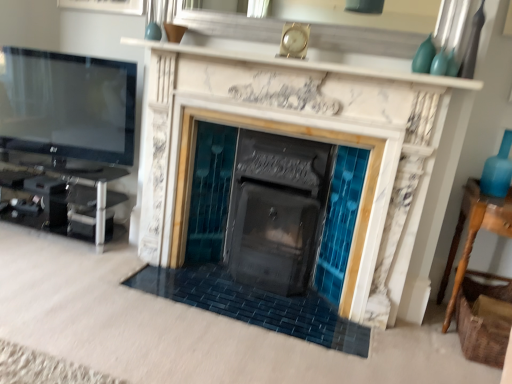
The width and height of the screenshot is (512, 384). What do you see at coordinates (67, 105) in the screenshot?
I see `flat screen tv at left` at bounding box center [67, 105].

Locate an element on the screen. The height and width of the screenshot is (384, 512). matte glass vase at upper right, which is the 1th turquoise in back-to-front order is located at coordinates (424, 56).

Find the location of a particular element. This screenshot has width=512, height=384. flat screen tv at left is located at coordinates (67, 105).

Would you say turquoise glass vase at upper right, which is the first turquoise from front to back, is inside or outside matte glass vase at upper right, which is the 1th turquoise in back-to-front order?

turquoise glass vase at upper right, which is the first turquoise from front to back, cannot be found inside matte glass vase at upper right, which is the 1th turquoise in back-to-front order.

Is turquoise glass vase at upper right, which is the first turquoise from front to back, in contact with matte glass vase at upper right, which is the 1th turquoise in back-to-front order?

Yes, turquoise glass vase at upper right, which is the first turquoise from front to back, is beside matte glass vase at upper right, which is the 1th turquoise in back-to-front order.

Considering the relative sizes of turquoise glass vase at upper right, which is the second turquoise in back-to-front order, and matte glass vase at upper right, which is the 1th turquoise in back-to-front order, in the image provided, is turquoise glass vase at upper right, which is the second turquoise in back-to-front order, thinner than matte glass vase at upper right, which is the 1th turquoise in back-to-front order,?

Indeed, turquoise glass vase at upper right, which is the second turquoise in back-to-front order, has a lesser width compared to matte glass vase at upper right, which is the 1th turquoise in back-to-front order.

Is turquoise glass vase at upper right, which is the second turquoise in back-to-front order, bigger or smaller than matte glass vase at upper right, positioned as the 2th turquoise in front-to-back order?

Considering their sizes, turquoise glass vase at upper right, which is the second turquoise in back-to-front order, takes up less space than matte glass vase at upper right, positioned as the 2th turquoise in front-to-back order.

Can you confirm if marble fireplace at center is wider than white marble mantle at upper center?

Yes, marble fireplace at center is wider than white marble mantle at upper center.

Looking at this image, is marble fireplace at center next to white marble mantle at upper center?

marble fireplace at center and white marble mantle at upper center are clearly separated.

From the image's perspective, between marble fireplace at center and white marble mantle at upper center, who is located below?

marble fireplace at center appears lower in the image.

Does marble fireplace at center have a lesser height compared to white marble mantle at upper center?

No, marble fireplace at center is not shorter than white marble mantle at upper center.

Is marble fireplace at center taller than matte glass vase at upper right, which is the 1th turquoise in back-to-front order?

Indeed, marble fireplace at center has a greater height compared to matte glass vase at upper right, which is the 1th turquoise in back-to-front order.

In the scene shown: Is marble fireplace at center not inside matte glass vase at upper right, positioned as the 2th turquoise in front-to-back order?

Yes, marble fireplace at center is not within matte glass vase at upper right, positioned as the 2th turquoise in front-to-back order.

Measure the distance from marble fireplace at center to matte glass vase at upper right, which is the 1th turquoise in back-to-front order.

marble fireplace at center is 37.07 inches away from matte glass vase at upper right, which is the 1th turquoise in back-to-front order.

Considering the relative sizes of marble fireplace at center and matte glass vase at upper right, which is the 1th turquoise in back-to-front order, in the image provided, is marble fireplace at center smaller than matte glass vase at upper right, which is the 1th turquoise in back-to-front order,?

Incorrect, marble fireplace at center is not smaller in size than matte glass vase at upper right, which is the 1th turquoise in back-to-front order.

Considering the positions of objects marble fireplace at center and turquoise glass vase at upper right, which is the second turquoise in back-to-front order, in the image provided, who is in front, marble fireplace at center or turquoise glass vase at upper right, which is the second turquoise in back-to-front order,?

marble fireplace at center.

From a real-world perspective, does marble fireplace at center sit lower than turquoise glass vase at upper right, which is the second turquoise in back-to-front order?

Yes, from a real-world perspective, marble fireplace at center is below turquoise glass vase at upper right, which is the second turquoise in back-to-front order.

Can you confirm if marble fireplace at center is wider than turquoise glass vase at upper right, which is the first turquoise from front to back?

Yes.

Considering the relative sizes of marble fireplace at center and turquoise glass vase at upper right, which is the first turquoise from front to back, in the image provided, is marble fireplace at center shorter than turquoise glass vase at upper right, which is the first turquoise from front to back,?

In fact, marble fireplace at center may be taller than turquoise glass vase at upper right, which is the first turquoise from front to back.

Which object is positioned more to the left, turquoise glass vase at upper right, which is the second turquoise in back-to-front order, or white marble mantle at upper center?

white marble mantle at upper center is more to the left.

Is turquoise glass vase at upper right, which is the first turquoise from front to back, situated inside white marble mantle at upper center or outside?

turquoise glass vase at upper right, which is the first turquoise from front to back, is not enclosed by white marble mantle at upper center.

Which is nearer, (434, 63) or (445, 77)?

Point (434, 63) appears to be farther away from the viewer than point (445, 77).

Is flat screen tv at left outside of matte glass vase at upper right, which is the 1th turquoise in back-to-front order?

Yes, flat screen tv at left is located beyond the bounds of matte glass vase at upper right, which is the 1th turquoise in back-to-front order.

Can you confirm if flat screen tv at left is thinner than matte glass vase at upper right, which is the 1th turquoise in back-to-front order?

No, flat screen tv at left is not thinner than matte glass vase at upper right, which is the 1th turquoise in back-to-front order.

Which object is positioned more to the left, flat screen tv at left or matte glass vase at upper right, which is the 1th turquoise in back-to-front order?

flat screen tv at left.

Find the location of a particular element. Image resolution: width=512 pixels, height=384 pixels. the 2nd turquoise positioned above the flat screen tv at left (from the image's perspective) is located at coordinates (424, 56).

In the scene shown: Is white marble mantle at upper center facing towards marble fireplace at center?

No, white marble mantle at upper center is not oriented towards marble fireplace at center.

In the image, is white marble mantle at upper center positioned in front of or behind marble fireplace at center?

Visually, white marble mantle at upper center is located behind marble fireplace at center.

Can you confirm if white marble mantle at upper center is thinner than marble fireplace at center?

Indeed, white marble mantle at upper center has a lesser width compared to marble fireplace at center.

Image resolution: width=512 pixels, height=384 pixels. I want to click on mantle lying behind the marble fireplace at center, so click(x=308, y=64).

Image resolution: width=512 pixels, height=384 pixels. In order to click on turquoise above the turquoise glass vase at upper right, which is the second turquoise in back-to-front order (from a real-world perspective) in this screenshot , I will do `click(424, 56)`.

Locate an element on the screen. Image resolution: width=512 pixels, height=384 pixels. fireplace on the left side of white marble mantle at upper center is located at coordinates (300, 169).

Based on their spatial positions, is white marble mantle at upper center or marble fireplace at center closer to blue glass vase at right?

Based on the image, white marble mantle at upper center appears to be nearer to blue glass vase at right.

Estimate the real-world distances between objects in this image. Which object is further from marble fireplace at center, white marble mantle at upper center or matte glass vase at upper right, which is the 1th turquoise in back-to-front order?

Among the two, matte glass vase at upper right, which is the 1th turquoise in back-to-front order, is located further to marble fireplace at center.

Based on their spatial positions, is wooden table at right or matte glass vase at upper right, which is the 1th turquoise in back-to-front order, further from flat screen tv at left?

Among the two, wooden table at right is located further to flat screen tv at left.

Considering their positions, is blue glass vase at right positioned further to marble fireplace at center than matte glass vase at upper right, positioned as the 2th turquoise in front-to-back order?

blue glass vase at right lies further to marble fireplace at center than the other object.

Based on the photo, from the image, which object appears to be farther from white marble mantle at upper center, matte glass vase at upper right, which is the 1th turquoise in back-to-front order, or turquoise glass vase at upper right, which is the second turquoise in back-to-front order?

Among the two, turquoise glass vase at upper right, which is the second turquoise in back-to-front order, is located further to white marble mantle at upper center.

When comparing their distances from matte glass vase at upper right, positioned as the 2th turquoise in front-to-back order, does turquoise glass vase at upper right, which is the second turquoise in back-to-front order, or marble fireplace at center seem further?

marble fireplace at center lies further to matte glass vase at upper right, positioned as the 2th turquoise in front-to-back order, than the other object.

Based on their spatial positions, is marble fireplace at center or blue glass vase at right further from matte glass vase at upper right, positioned as the 2th turquoise in front-to-back order?

marble fireplace at center is positioned further to the anchor matte glass vase at upper right, positioned as the 2th turquoise in front-to-back order.

Based on their spatial positions, is marble fireplace at center or blue glass vase at right closer to white marble mantle at upper center?

Among the two, marble fireplace at center is located nearer to white marble mantle at upper center.

Find the location of a particular element. This screenshot has width=512, height=384. mantle between marble fireplace at center and matte glass vase at upper right, which is the 1th turquoise in back-to-front order is located at coordinates (x=308, y=64).

At what (x,y) coordinates should I click in order to perform the action: click on turquoise between marble fireplace at center and turquoise glass vase at upper right, which is the first turquoise from front to back, in the horizontal direction. Please return your answer as a coordinate pair (x, y). The width and height of the screenshot is (512, 384). Looking at the image, I should click on (424, 56).

Find the location of `mantle located between flat screen tv at left and matte glass vase at upper right, positioned as the 2th turquoise in front-to-back order, in the left-right direction`. mantle located between flat screen tv at left and matte glass vase at upper right, positioned as the 2th turquoise in front-to-back order, in the left-right direction is located at coordinates (308, 64).

Identify the location of turquoise between matte glass vase at upper right, positioned as the 2th turquoise in front-to-back order, and blue glass vase at right. (439, 63).